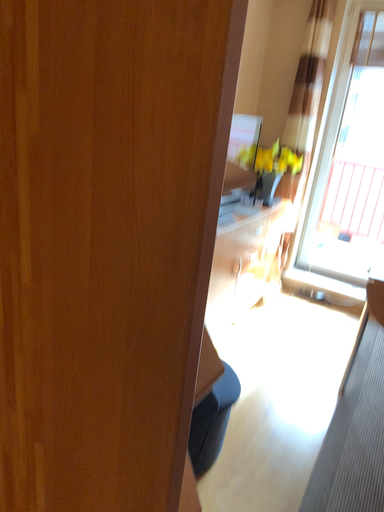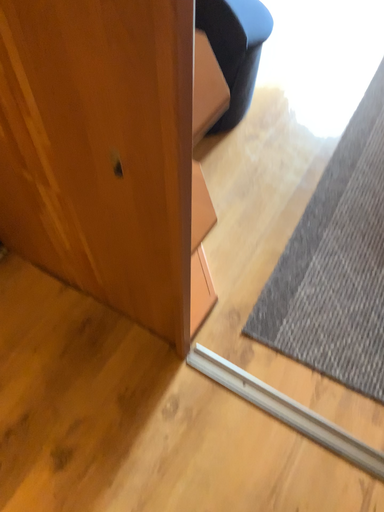
Question: How did the camera likely rotate when shooting the video?

Choices:
 (A) rotated upward
 (B) rotated downward

Answer: (B)